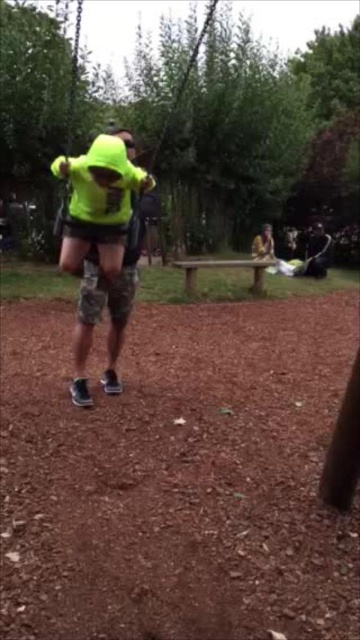
You are a photographer trying to capture the neon yellow hoodie at center and the neon yellow fabric at center in a single shot. Based on the scene, which object is closer to the camera?

The neon yellow hoodie at center is positioned under the neon yellow fabric at center, meaning it is closer to the camera.

You are a photographer trying to capture the neon yellow fabric at center and the brown wooden bench at center in the same frame. Based on their positions, which object should you focus on first to ensure both are in the shot?

The neon yellow fabric at center is in front of the brown wooden bench at center, so you should focus on the brown wooden bench at center first to ensure both are in the shot.

You are standing at the point labeled point (105,134) and want to walk to the point labeled point (255,268). Which direction should you move in relation to the camera view?

You should move towards the lower right direction in the camera view because point (255,268) is further away from the camera compared to point (105,134).